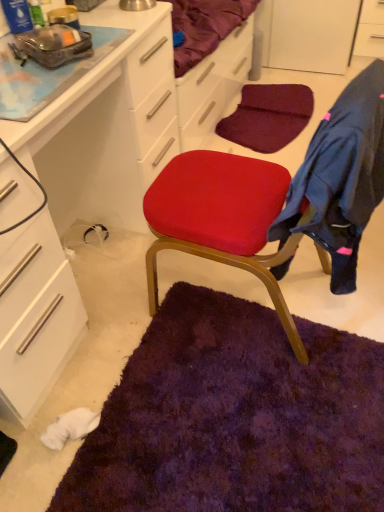
Question: Considering the relative sizes of white glossy cabinet at upper right, which ranks as the 2th cabinetry in left-to-right order, and matte white cabinet at center, the 1th cabinetry positioned from the front, in the image provided, is white glossy cabinet at upper right, which ranks as the 2th cabinetry in left-to-right order, bigger than matte white cabinet at center, the 1th cabinetry positioned from the front,?

Choices:
 (A) yes
 (B) no

Answer: (B)

Question: Does white glossy cabinet at upper right, placed as the first cabinetry when sorted from top to bottom, have a greater width compared to matte white cabinet at center, which is the first cabinetry in bottom-to-top order?

Choices:
 (A) yes
 (B) no

Answer: (B)

Question: Does white glossy cabinet at upper right, which appears as the first cabinetry when viewed from the back, turn towards matte white cabinet at center, placed as the 1th cabinetry when sorted from left to right?

Choices:
 (A) no
 (B) yes

Answer: (A)

Question: Is white glossy cabinet at upper right, which appears as the first cabinetry when viewed from the back, at the left side of matte white cabinet at center, which is the first cabinetry in bottom-to-top order?

Choices:
 (A) yes
 (B) no

Answer: (B)

Question: From the image's perspective, is white glossy cabinet at upper right, which ranks as the 2th cabinetry in left-to-right order, below matte white cabinet at center, which is counted as the 2th cabinetry, starting from the back?

Choices:
 (A) no
 (B) yes

Answer: (A)

Question: Is white glossy cabinet at upper right, which appears as the first cabinetry when viewed from the back, further to the viewer compared to matte white cabinet at center, which is the first cabinetry in bottom-to-top order?

Choices:
 (A) no
 (B) yes

Answer: (B)

Question: From a real-world perspective, is matte white cabinet at center, which ranks as the 2th cabinetry in right-to-left order, positioned over dark blue fleece jacket at right based on gravity?

Choices:
 (A) no
 (B) yes

Answer: (A)

Question: Does matte white cabinet at center, the 2th cabinetry viewed from the top, have a larger size compared to dark blue fleece jacket at right?

Choices:
 (A) yes
 (B) no

Answer: (A)

Question: From the image's perspective, is matte white cabinet at center, which is the first cabinetry in bottom-to-top order, under dark blue fleece jacket at right?

Choices:
 (A) no
 (B) yes

Answer: (A)

Question: Is matte white cabinet at center, the 2th cabinetry viewed from the top, taller than dark blue fleece jacket at right?

Choices:
 (A) no
 (B) yes

Answer: (B)

Question: Is matte white cabinet at center, which ranks as the 2th cabinetry in right-to-left order, wider than dark blue fleece jacket at right?

Choices:
 (A) no
 (B) yes

Answer: (B)

Question: Is matte white cabinet at center, the 1th cabinetry positioned from the front, aimed at dark blue fleece jacket at right?

Choices:
 (A) yes
 (B) no

Answer: (A)

Question: From a real-world perspective, is matte white cabinet at center, which ranks as the 2th cabinetry in right-to-left order, beneath white glossy cabinet at upper right, which ranks as the 2th cabinetry in left-to-right order?

Choices:
 (A) yes
 (B) no

Answer: (B)